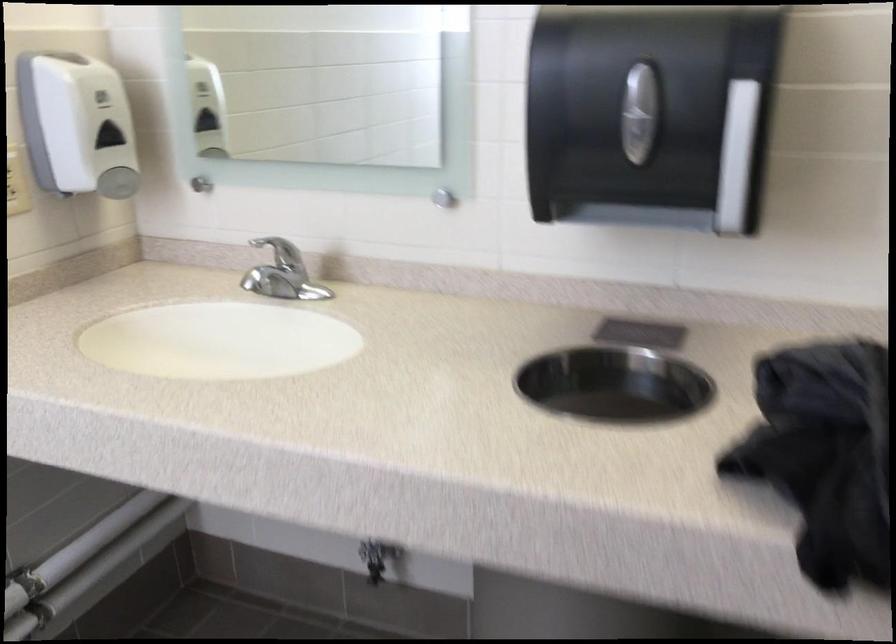
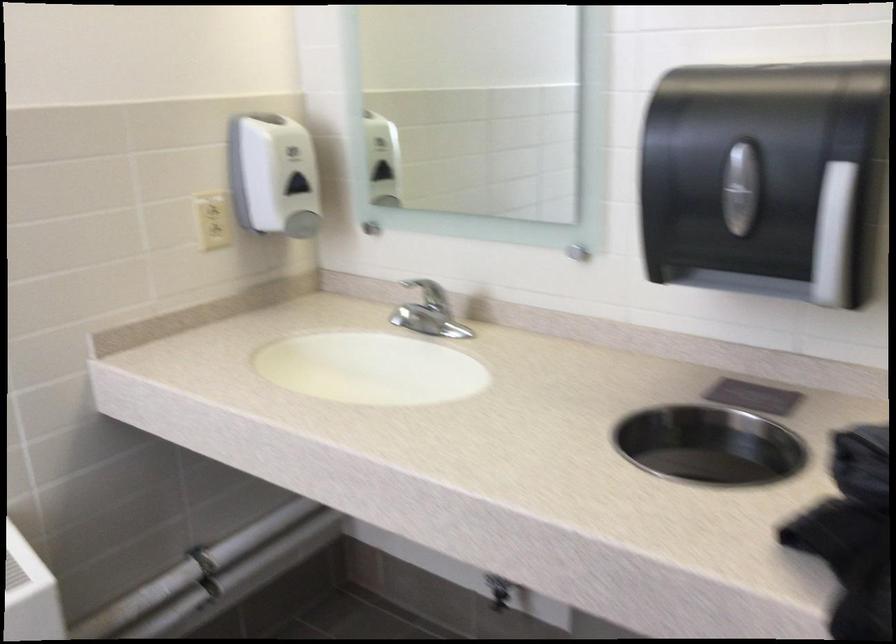
Locate, in the second image, the point that corresponds to [719,155] in the first image.

(833, 236)